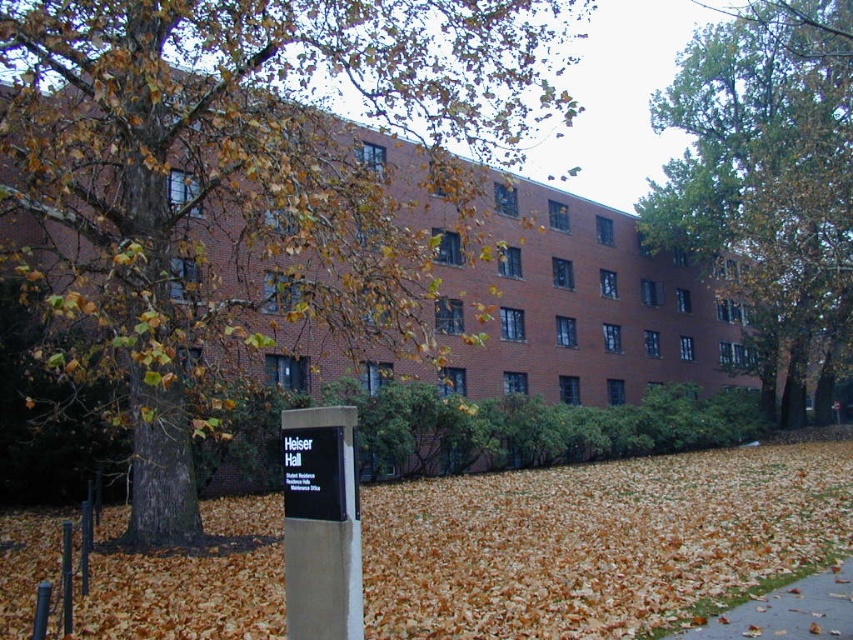
Question: Does brown leafy tree at center come behind brown asphalt pavement at lower right?

Choices:
 (A) no
 (B) yes

Answer: (B)

Question: Does brown leafy tree at center appear under green leafy tree at upper right?

Choices:
 (A) yes
 (B) no

Answer: (B)

Question: Which object is positioned closest to the green leafy tree at upper right?

Choices:
 (A) brown leafy tree at center
 (B) brown leaf litter at lower center
 (C) brown asphalt pavement at lower right

Answer: (A)

Question: Which object is the farthest from the brown leafy tree at center?

Choices:
 (A) brown leaf litter at lower center
 (B) brown asphalt pavement at lower right
 (C) green leafy tree at upper right

Answer: (B)

Question: Is brown leafy tree at center closer to camera compared to green leafy tree at upper right?

Choices:
 (A) no
 (B) yes

Answer: (B)

Question: Which point is farther from the camera taking this photo?

Choices:
 (A) (836, 605)
 (B) (235, 525)

Answer: (B)